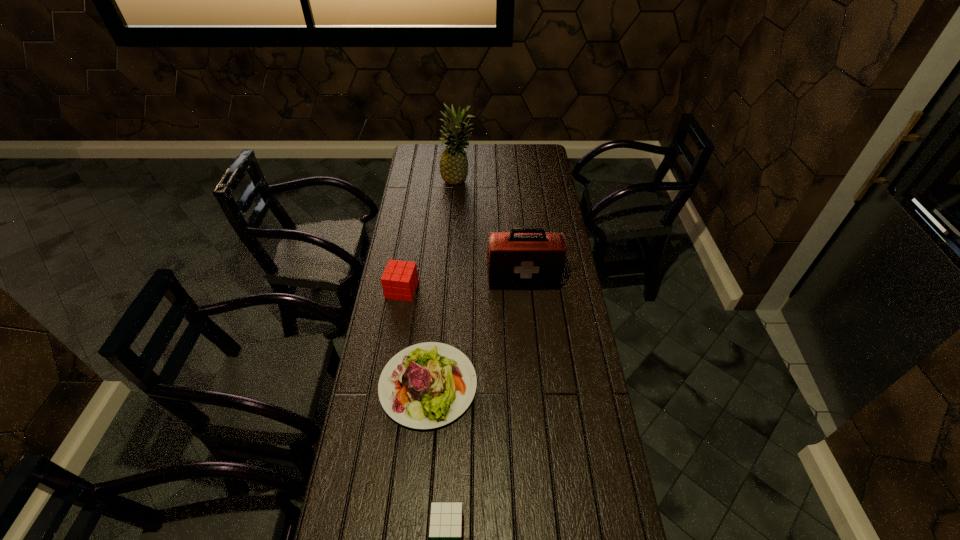
Locate an element on the screen. This screenshot has width=960, height=540. pineapple is located at coordinates (453, 164).

Locate an element on the screen. the farthest object is located at coordinates (453, 164).

Where is `the fourth shortest object`? The image size is (960, 540). the fourth shortest object is located at coordinates point(526,258).

You are a GUI agent. You are given a task and a screenshot of the screen. Output one action in this format:
    pyautogui.click(x=<x>, y=<y>)
    Task: Click on the first aid kit
    This screenshot has width=960, height=540.
    Given the screenshot: What is the action you would take?
    pyautogui.click(x=526, y=258)

Where is `the taller cube`? This screenshot has width=960, height=540. the taller cube is located at coordinates (399, 281).

Identify the location of the third tallest object. (399, 281).

At what (x,y) coordinates should I click in order to perform the action: click on salad plate. Please return your answer as a coordinate pair (x, y). This screenshot has height=540, width=960. Looking at the image, I should click on (427, 385).

Locate an element on the screen. This screenshot has width=960, height=540. vacant space located 0.400m on the front of the pineapple is located at coordinates (454, 242).

Locate an element on the screen. The height and width of the screenshot is (540, 960). free space located on the side of the fourth shortest object with the cross symbol is located at coordinates (527, 321).

What are the coordinates of `vacant region located 0.350m on the right of the taller cube` in the screenshot? It's located at (505, 290).